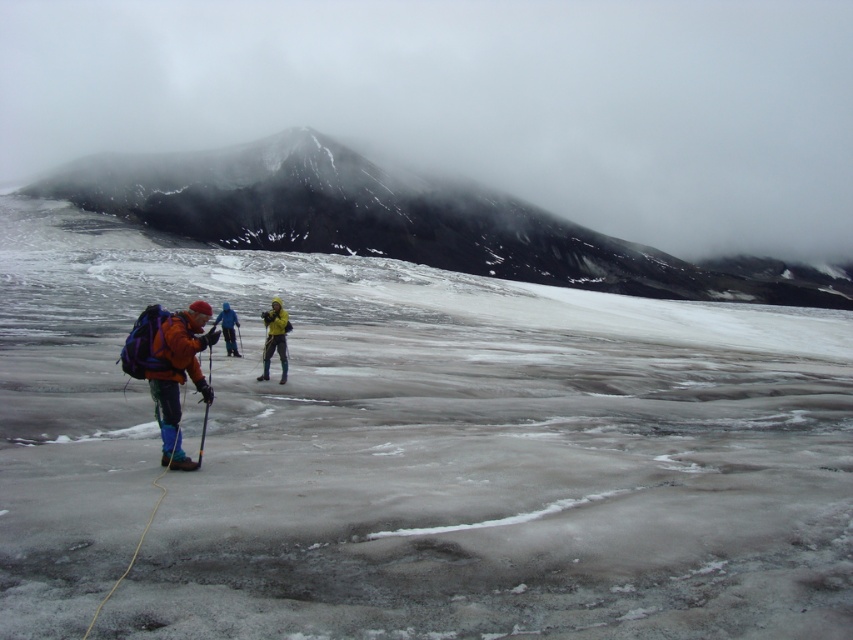
You are planning to take a photo of the snowy rocky mountain at upper center and orange fleece jacket at center. Which object is wider in the image?

The snowy rocky mountain at upper center is wider than the orange fleece jacket at center.

You are a mountaineer planning to climb the snowy rocky mountain at upper center. Given that your climbing gear can handle slopes up to 200 meters in height, can you safely attempt the climb based on the distance provided?

The snowy rocky mountain at upper center is 197.06 meters away from the viewer. Since your gear can handle up to 200 meters, you can safely attempt the climb as the distance is within the gear limit.